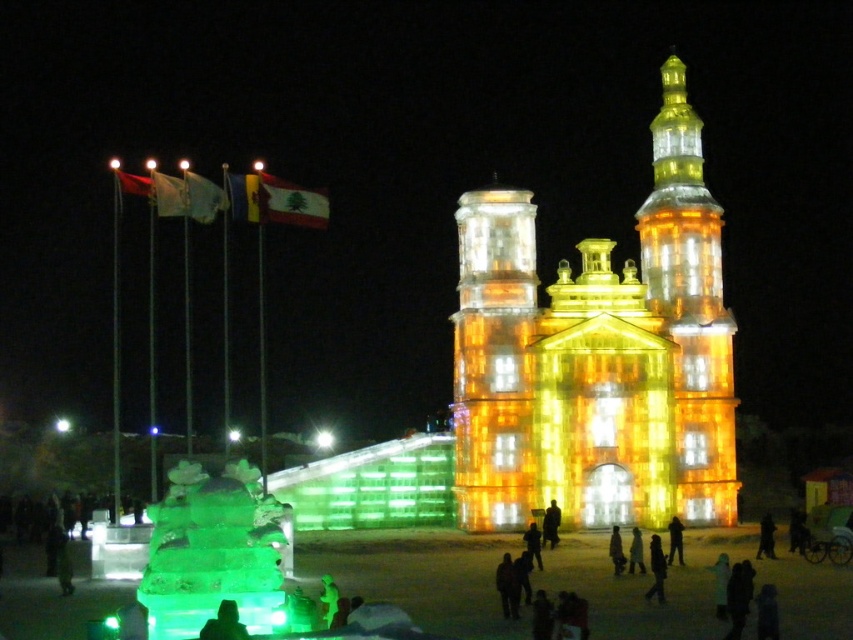
Which is below, illuminated glass tower at upper right or illuminated ice tower at center?

illuminated ice tower at center is lower down.

Does point (695, 497) come farther from viewer compared to point (496, 474)?

Yes, point (695, 497) is behind point (496, 474).

This screenshot has width=853, height=640. Find the location of `illuminated glass tower at upper right`. illuminated glass tower at upper right is located at coordinates (689, 307).

Does point (553, 346) come behind point (676, 56)?

No.

Which is more to the right, illuminated ice sculpture at center or illuminated glass tower at upper right?

From the viewer's perspective, illuminated glass tower at upper right appears more on the right side.

Between point (625, 387) and point (679, 154), which one is positioned behind?

The point (679, 154) is more distant.

Locate an element on the screen. This screenshot has width=853, height=640. illuminated ice sculpture at center is located at coordinates 598,356.

Describe the element at coordinates (598, 356) in the screenshot. I see `illuminated ice sculpture at center` at that location.

Does point (601, 468) come behind point (492, 353)?

Yes.

Locate an element on the screen. This screenshot has width=853, height=640. illuminated ice sculpture at center is located at coordinates (x=598, y=356).